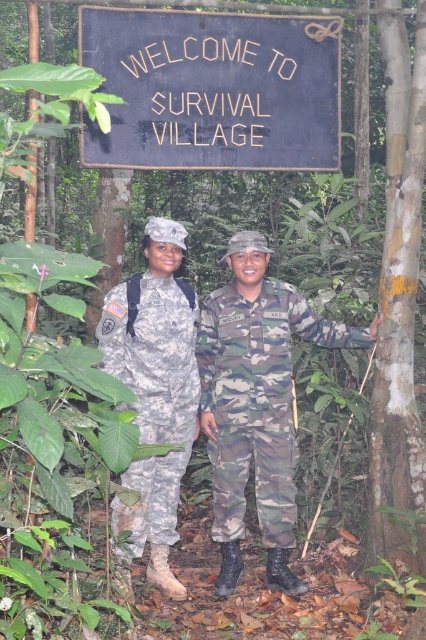
Is camouflage uniform at center bigger than camouflage fabric uniform at left?

Indeed, camouflage uniform at center has a larger size compared to camouflage fabric uniform at left.

Consider the image. Does camouflage uniform at center appear on the right side of camouflage fabric uniform at left?

Yes, camouflage uniform at center is to the right of camouflage fabric uniform at left.

This screenshot has height=640, width=426. Find the location of `camouflage uniform at center`. camouflage uniform at center is located at coordinates (256, 403).

How distant is black wood sign at upper center from camouflage uniform at center?

They are 1.40 meters apart.

Which is below, black wood sign at upper center or camouflage uniform at center?

camouflage uniform at center

At what (x,y) coordinates should I click in order to perform the action: click on black wood sign at upper center. Please return your answer as a coordinate pair (x, y). Looking at the image, I should click on (213, 90).

I want to click on black wood sign at upper center, so click(x=213, y=90).

Is point (117, 74) behind point (213, 394)?

No, it is in front of (213, 394).

Which is more to the left, black wood sign at upper center or camo fabric uniform at center?

black wood sign at upper center is more to the left.

Does point (81, 154) come in front of point (209, 454)?

Yes, point (81, 154) is in front of point (209, 454).

This screenshot has height=640, width=426. I want to click on black wood sign at upper center, so click(x=213, y=90).